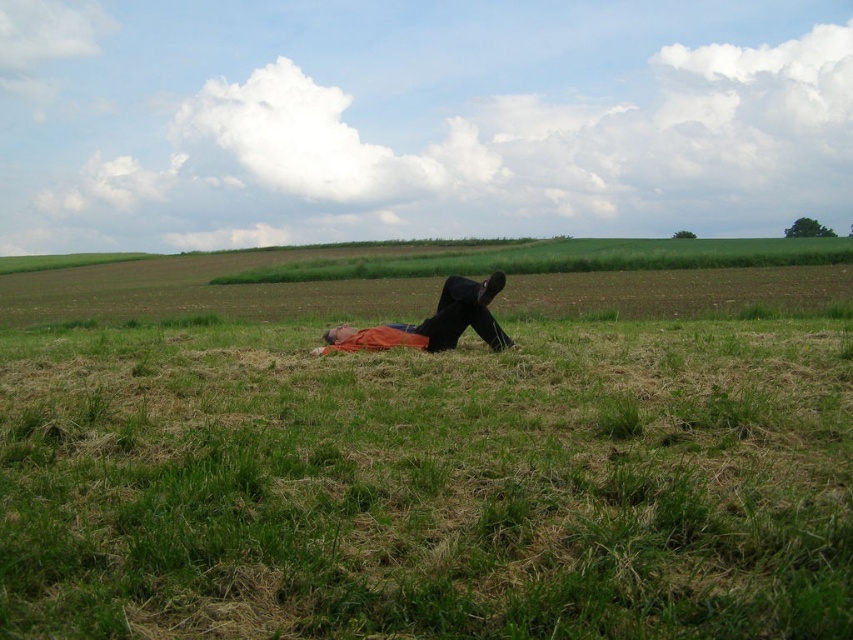
Looking at this image, you are a photographer planning to capture the scene with the green grassy at center and the orange cotton shirt at center. Based on their heights, which object would appear closer to the camera in the final photo?

The orange cotton shirt at center appears closer to the camera because it is taller than the green grassy at center.

You are a photographer trying to capture the person in the scene. Where should you position yourself to ensure the green grassy at center is in the background of your photo?

To have the green grassy at center as the background, position yourself behind the person so that the grass is farther away from the camera. Since the person is lying on the green grassy at center, moving behind them will place the grass in the background.

You are a photographer trying to capture a closeup of the orange cotton shirt at center and orange fabric blanket at center. Your camera can focus on objects within 5 inches. Can you focus on both objects at the same time?

The orange cotton shirt at center is 7.06 inches away from orange fabric blanket at center. Since the distance between them is greater than 5 inches, the camera cannot focus on both objects simultaneously.